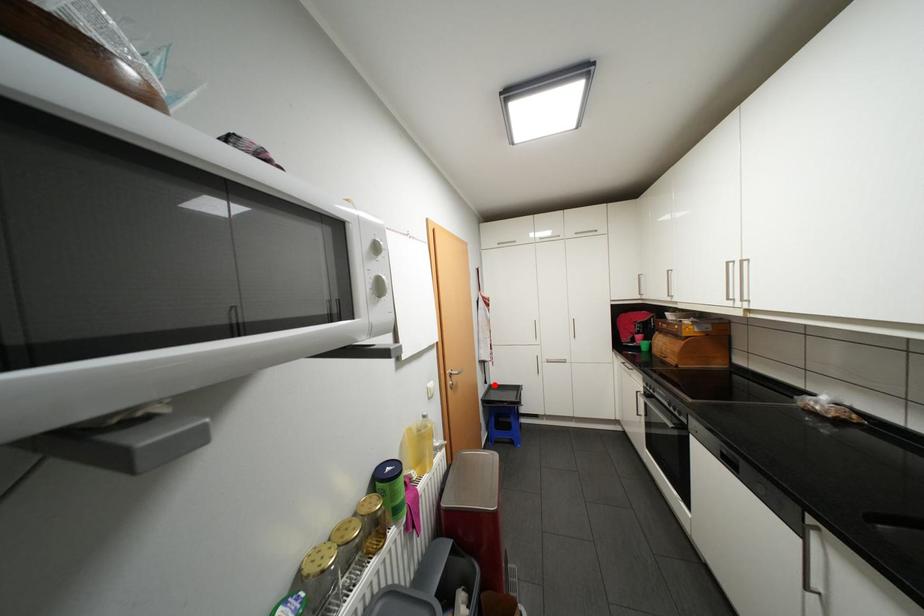
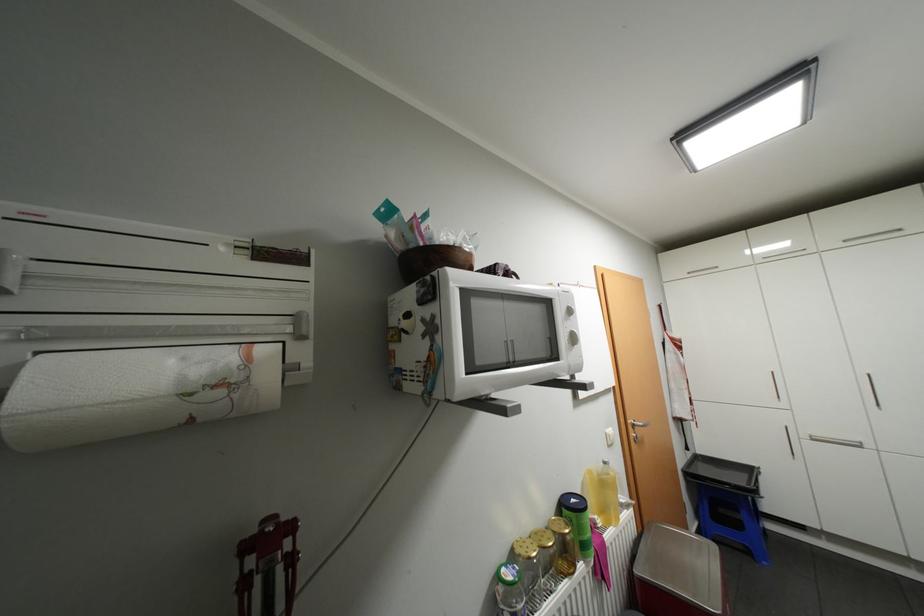
Question: A red point is marked in image1. In image2, is the corresponding 3D point closer to the camera or farther? Reply with the corresponding letter.

Choices:
 (A) The corresponding 3D point is closer.
 (B) The corresponding 3D point is farther.

Answer: (A)